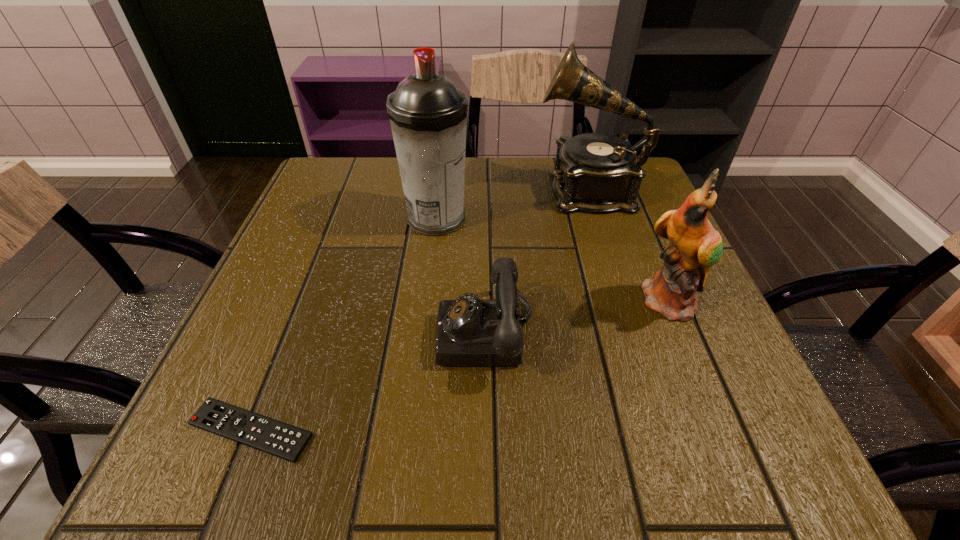
I want to click on free spot located 0.110m on the front-facing side of the parrot, so click(706, 380).

I want to click on vacant region located 0.150m on the dial of the telephone, so click(350, 334).

Where is `free spot located 0.050m on the dial of the telephone`? The image size is (960, 540). free spot located 0.050m on the dial of the telephone is located at coordinates (409, 334).

Identify the location of free point located on the dial of the telephone. This screenshot has width=960, height=540. (379, 334).

Where is `vacant area situated 0.090m on the right of the nearest object`? This screenshot has height=540, width=960. vacant area situated 0.090m on the right of the nearest object is located at coordinates (377, 430).

Identify the location of aerosol can located at the far edge. The width and height of the screenshot is (960, 540). click(428, 114).

Where is `phonograph record that is at the far edge`? phonograph record that is at the far edge is located at coordinates coord(594,172).

This screenshot has height=540, width=960. Find the location of `object present at the near edge`. object present at the near edge is located at coordinates (285, 441).

Identify the location of object present at the left edge. (285, 441).

Locate an element on the screen. The image size is (960, 540). phonograph record located at the right edge is located at coordinates (594, 172).